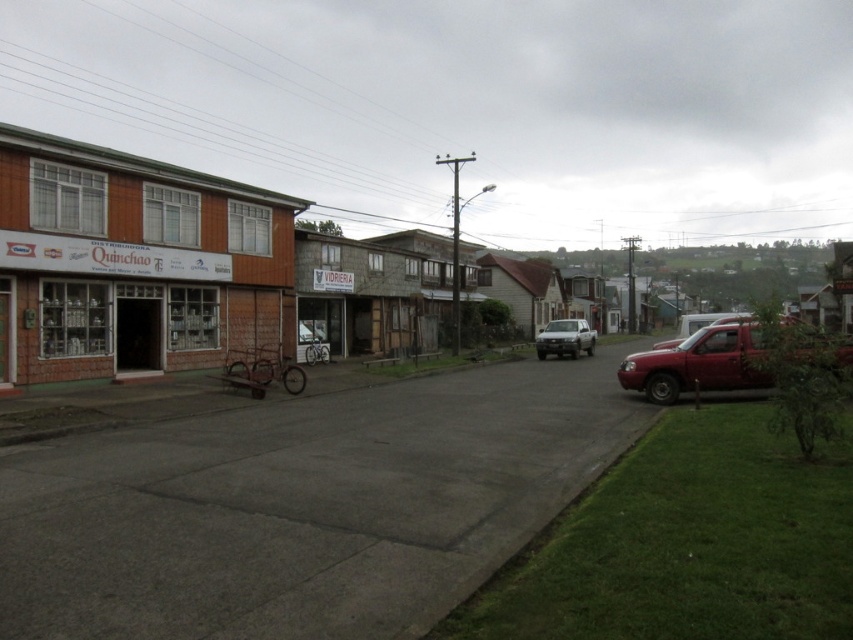
Question: Which object is positioned farthest from the satin silver sedan at center?

Choices:
 (A) metallic red truck at right
 (B) brown wooden building at left
 (C) brown wooden store at left

Answer: (C)

Question: Which point is closer to the camera taking this photo?

Choices:
 (A) 558,333
 (B) 682,371
 (C) 720,317

Answer: (B)

Question: Considering the real-world distances, which object is farthest from the metallic red pickup truck at right?

Choices:
 (A) brown wooden store at left
 (B) brown wooden building at left
 (C) metallic red truck at right
 (D) satin silver sedan at center

Answer: (B)

Question: Can you confirm if brown wooden building at left is bigger than satin silver sedan at center?

Choices:
 (A) no
 (B) yes

Answer: (B)

Question: Is brown wooden store at left thinner than metallic red pickup truck at right?

Choices:
 (A) no
 (B) yes

Answer: (A)

Question: Can you confirm if brown wooden building at left is positioned below satin silver sedan at center?

Choices:
 (A) no
 (B) yes

Answer: (A)